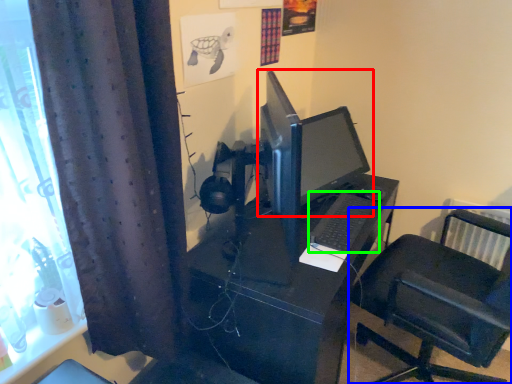
Question: Estimate the real-world distances between objects in this image. Which object is farther from computer monitor (highlighted by a red box), furniture (highlighted by a blue box) or computer keyboard (highlighted by a green box)?

Choices:
 (A) furniture
 (B) computer keyboard

Answer: (A)